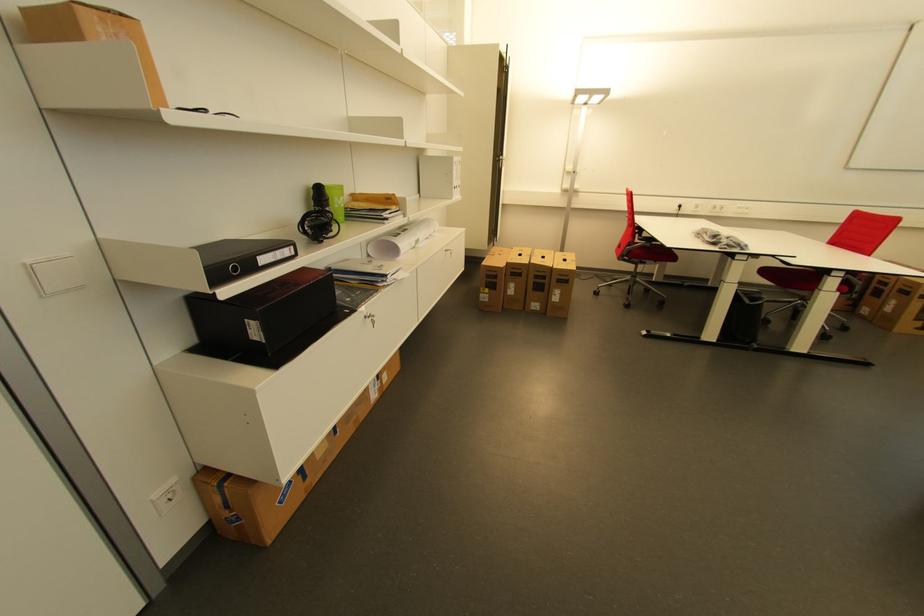
This screenshot has width=924, height=616. Describe the element at coordinates (371, 318) in the screenshot. I see `the cabinet key` at that location.